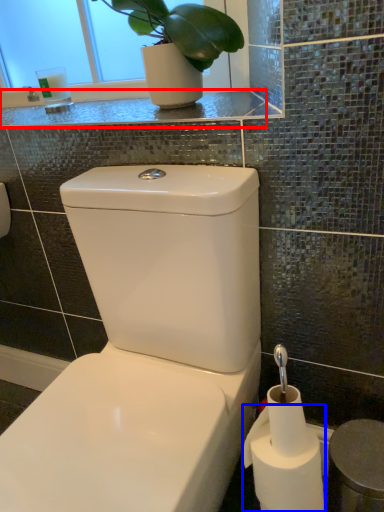
Question: Which of the following is the closest to the observer, counter top (highlighted by a red box) or toilet paper (highlighted by a blue box)?

Choices:
 (A) counter top
 (B) toilet paper

Answer: (B)